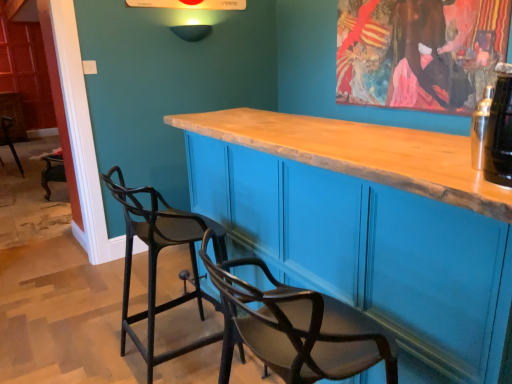
What do you see at coordinates (9, 139) in the screenshot? I see `black matte chair at left, the second chair from the front` at bounding box center [9, 139].

Locate an element on the screen. This screenshot has width=512, height=384. black matte chair at left, which is the first chair from front to back is located at coordinates (156, 261).

This screenshot has height=384, width=512. What do you see at coordinates (156, 261) in the screenshot?
I see `black matte chair at left, positioned as the first chair in right-to-left order` at bounding box center [156, 261].

At what (x,y) coordinates should I click in order to perform the action: click on wooden cabinet at center. Please return your answer as a coordinate pair (x, y). This screenshot has height=384, width=512. Looking at the image, I should click on (368, 225).

Considering the sizes of objects wooden cabinet at center and black matte chair at left, which is the 2th chair in right-to-left order, in the image provided, who is wider, wooden cabinet at center or black matte chair at left, which is the 2th chair in right-to-left order,?

wooden cabinet at center.

Is wooden cabinet at center oriented towards black matte chair at left, which is the 2th chair in right-to-left order?

No, wooden cabinet at center is not facing towards black matte chair at left, which is the 2th chair in right-to-left order.

Between point (328, 202) and point (21, 173), which one is positioned behind?

Point (21, 173)

Does wooden cabinet at center contain black matte chair at left, which ranks as the second chair in bottom-to-top order?

That's incorrect, black matte chair at left, which ranks as the second chair in bottom-to-top order, is not inside wooden cabinet at center.

From the image's perspective, is black matte chair at left, the second chair viewed from the left, on wooden cabinet at center?

No, from the image's perspective, black matte chair at left, the second chair viewed from the left, is not on top of wooden cabinet at center.

Looking at this image, can you tell me how much black matte chair at left, positioned as the first chair in right-to-left order, and wooden cabinet at center differ in facing direction?

black matte chair at left, positioned as the first chair in right-to-left order, and wooden cabinet at center are facing 2.01 degrees away from each other.

Which object is closer to the camera, black matte chair at left, which is the 2th chair from back to front, or wooden cabinet at center?

wooden cabinet at center is closer to the camera.

Which of these two, black matte chair at left, which is the 2th chair from back to front, or wooden cabinet at center, stands shorter?

black matte chair at left, which is the 2th chair from back to front, is shorter.

Can black glass bottle at upper right be found inside black matte chair at left, which is counted as the 1th chair, starting from the back?

That's incorrect, black glass bottle at upper right is not inside black matte chair at left, which is counted as the 1th chair, starting from the back.

Which of these two, black matte chair at left, positioned as the 1th chair in top-to-bottom order, or black glass bottle at upper right, is wider?

black matte chair at left, positioned as the 1th chair in top-to-bottom order.

Is black matte chair at left, positioned as the 1th chair in top-to-bottom order, not close to black glass bottle at upper right?

Indeed, black matte chair at left, positioned as the 1th chair in top-to-bottom order, is not near black glass bottle at upper right.

The image size is (512, 384). In order to click on cabinetry in front of the black matte chair at left, which is counted as the 1th chair, starting from the back in this screenshot , I will do `click(368, 225)`.

From the image's perspective, does black matte chair at left, which ranks as the second chair in bottom-to-top order, appear lower than wooden cabinet at center?

No.

From a real-world perspective, is black matte chair at left, which ranks as the second chair in bottom-to-top order, on top of wooden cabinet at center?

Actually, black matte chair at left, which ranks as the second chair in bottom-to-top order, is physically below wooden cabinet at center in the real world.

Does black matte chair at left, the second chair from the front, have a greater width compared to wooden cabinet at center?

No.

From a real-world perspective, is black matte chair at left, the second chair viewed from the left, positioned over black glass bottle at upper right based on gravity?

No.

Is point (200, 239) closer to camera compared to point (505, 176)?

No.

Find the location of a particular element. beverage above the black matte chair at left, which is the 2th chair from back to front (from a real-world perspective) is located at coordinates (500, 130).

Between black matte chair at left, acting as the 2th chair starting from the top, and black glass bottle at upper right, which one has smaller width?

black glass bottle at upper right is thinner.

Does point (220, 229) come farther from viewer compared to point (7, 144)?

No, it is in front of (7, 144).

Looking at this image, is black matte chair at left, acting as the 2th chair starting from the top, looking in the opposite direction of black matte chair at left, which is the 2th chair in right-to-left order?

No, black matte chair at left, acting as the 2th chair starting from the top, is not facing away from black matte chair at left, which is the 2th chair in right-to-left order.

Which is correct: black matte chair at left, which is the 2th chair from back to front, is inside black matte chair at left, the second chair from the front, or outside of it?

black matte chair at left, which is the 2th chair from back to front, is not inside black matte chair at left, the second chair from the front, it's outside.

You are a GUI agent. You are given a task and a screenshot of the screen. Output one action in this format:
    pyautogui.click(x=<x>, y=<y>)
    Task: Click on the beverage on the right of black matte chair at left, the second chair from the front
    The image size is (512, 384).
    Given the screenshot: What is the action you would take?
    pyautogui.click(x=500, y=130)

Is black glass bottle at upper right positioned far away from black matte chair at left, which is the 2th chair in right-to-left order?

black glass bottle at upper right is positioned a significant distance from black matte chair at left, which is the 2th chair in right-to-left order.

Is black glass bottle at upper right facing away from black matte chair at left, which ranks as the second chair in bottom-to-top order?

No, black glass bottle at upper right's orientation is not away from black matte chair at left, which ranks as the second chair in bottom-to-top order.

Based on their sizes in the image, would you say black glass bottle at upper right is bigger or smaller than black matte chair at left, which ranks as the second chair in bottom-to-top order?

Clearly, black glass bottle at upper right is smaller in size than black matte chair at left, which ranks as the second chair in bottom-to-top order.

The height and width of the screenshot is (384, 512). I want to click on the 2nd chair positioned below the wooden cabinet at center (from a real-world perspective), so click(9, 139).

Find the location of a particular element. chair below the wooden cabinet at center (from the image's perspective) is located at coordinates (156, 261).

Estimate the real-world distances between objects in this image. Which object is further from black matte chair at left, which is the first chair from front to back, black matte chair at left, which is counted as the 1th chair, starting from the back, or wooden cabinet at center?

Among the two, black matte chair at left, which is counted as the 1th chair, starting from the back, is located further to black matte chair at left, which is the first chair from front to back.

Considering their positions, is black glass bottle at upper right positioned closer to black matte chair at left, the second chair viewed from the left, than wooden cabinet at center?

wooden cabinet at center.

When comparing their distances from black matte chair at left, the second chair from the front, does black matte chair at left, which is the 2th chair from back to front, or wooden cabinet at center seem closer?

The object closer to black matte chair at left, the second chair from the front, is black matte chair at left, which is the 2th chair from back to front.

Looking at the image, which one is located further to black glass bottle at upper right, wooden cabinet at center or black matte chair at left, the 1th chair in the bottom-to-top sequence?

The object further to black glass bottle at upper right is black matte chair at left, the 1th chair in the bottom-to-top sequence.

From the image, which object appears to be farther from black matte chair at left, the first chair in the left-to-right sequence, wooden cabinet at center or black matte chair at left, which is the 2th chair from back to front?

wooden cabinet at center is positioned further to the anchor black matte chair at left, the first chair in the left-to-right sequence.

Considering their positions, is wooden cabinet at center positioned further to black matte chair at left, the 1th chair in the bottom-to-top sequence, than black glass bottle at upper right?

Based on the image, black glass bottle at upper right appears to be further to black matte chair at left, the 1th chair in the bottom-to-top sequence.

Looking at this image, from the image, which object appears to be nearer to black matte chair at left, the second chair viewed from the left, wooden cabinet at center or black matte chair at left, the first chair in the left-to-right sequence?

wooden cabinet at center.

Estimate the real-world distances between objects in this image. Which object is further from black glass bottle at upper right, black matte chair at left, which ranks as the second chair in bottom-to-top order, or wooden cabinet at center?

black matte chair at left, which ranks as the second chair in bottom-to-top order.

At what (x,y) coordinates should I click in order to perform the action: click on chair between black glass bottle at upper right and black matte chair at left, the second chair from the front, from front to back. Please return your answer as a coordinate pair (x, y). Looking at the image, I should click on (156, 261).

Locate an element on the screen. chair located between wooden cabinet at center and black matte chair at left, the second chair from the front, in the depth direction is located at coordinates (156, 261).

What are the coordinates of `beverage positioned between wooden cabinet at center and black matte chair at left, the second chair from the front, from near to far` in the screenshot? It's located at (500, 130).

Find the location of a particular element. cabinetry between black matte chair at left, the 1th chair in the bottom-to-top sequence, and black glass bottle at upper right, in the horizontal direction is located at coordinates (368, 225).